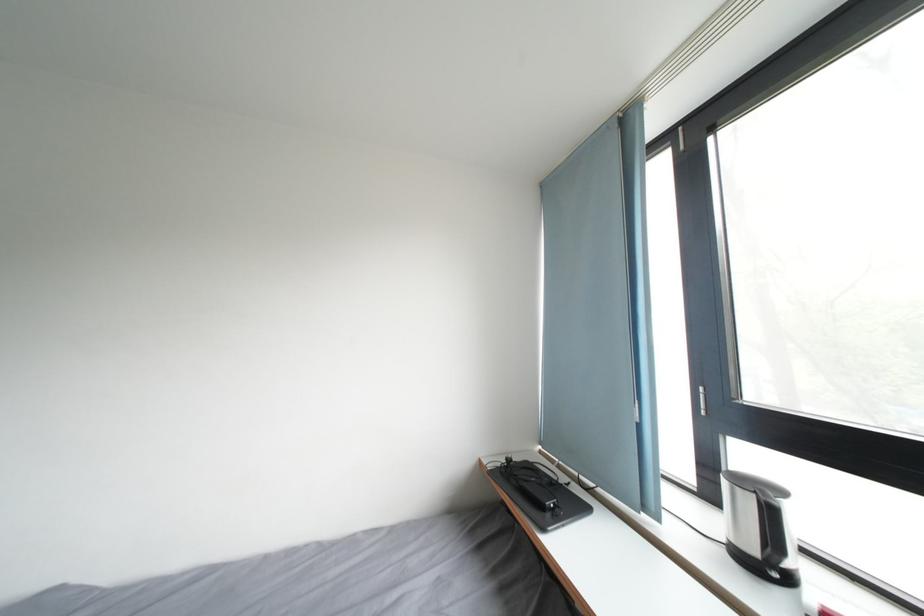
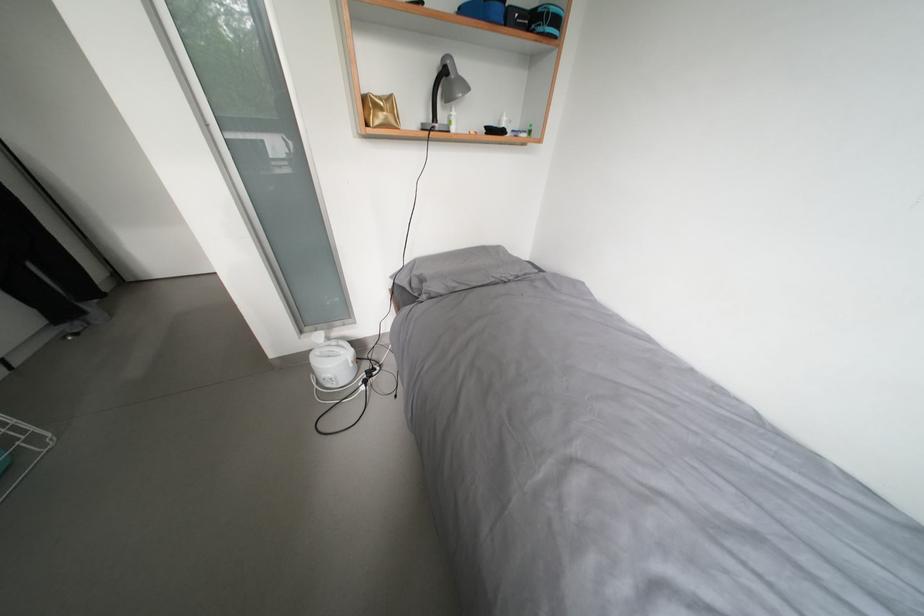
Based on the continuous images, in which direction is the camera rotating?

The rotation direction of the camera is left-down.